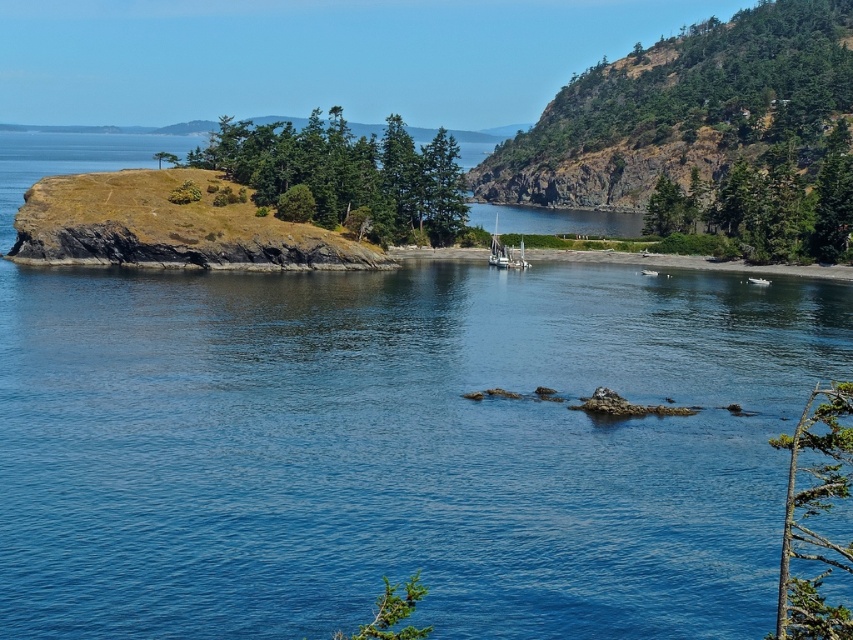
Question: Is clear blue water at center to the left of wooden sailboat at center from the viewer's perspective?

Choices:
 (A) yes
 (B) no

Answer: (A)

Question: Which object is farther from the camera taking this photo?

Choices:
 (A) clear blue water at center
 (B) wooden sailboat at center

Answer: (B)

Question: Which point is closer to the camera?

Choices:
 (A) (497, 228)
 (B) (387, 358)

Answer: (B)

Question: Does clear blue water at center appear under wooden sailboat at center?

Choices:
 (A) no
 (B) yes

Answer: (B)

Question: Is clear blue water at center behind wooden sailboat at center?

Choices:
 (A) no
 (B) yes

Answer: (A)

Question: Which point is closer to the camera?

Choices:
 (A) wooden sailboat at center
 (B) clear blue water at center

Answer: (B)